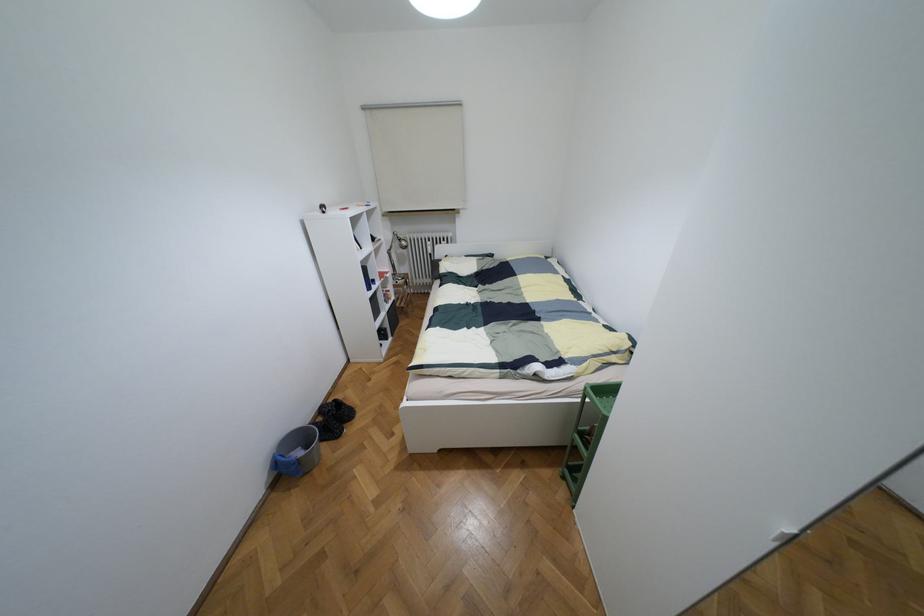
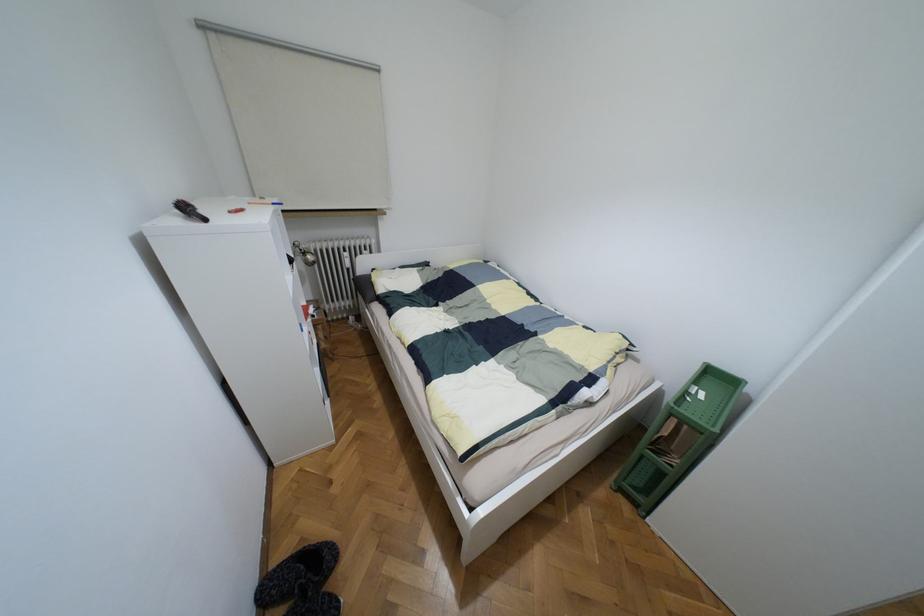
Question: The images are taken continuously from a first-person perspective. In which direction is your viewpoint rotating?

Choices:
 (A) Left
 (B) Right
 (C) Up
 (D) Down

Answer: (B)